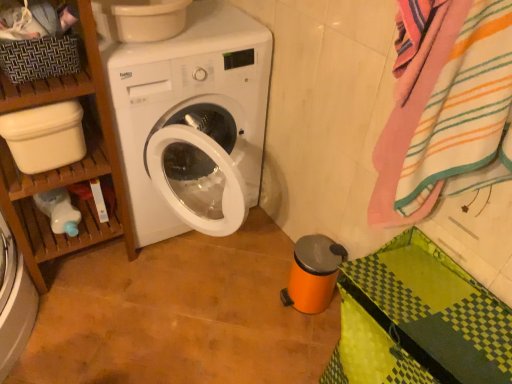
This screenshot has width=512, height=384. Describe the element at coordinates (66, 166) in the screenshot. I see `wooden shelf at left` at that location.

Where is `wooden shelf at left`? The width and height of the screenshot is (512, 384). wooden shelf at left is located at coordinates (66, 166).

Between wooden shelf at left and striped cotton bath towel at right, which one appears on the right side from the viewer's perspective?

striped cotton bath towel at right.

Based on the photo, is wooden shelf at left wider or thinner than striped cotton bath towel at right?

Clearly, wooden shelf at left has more width compared to striped cotton bath towel at right.

Does point (92, 30) come closer to viewer compared to point (509, 86)?

No, it is not.

I want to click on shelf located underneath the striped cotton bath towel at right (from a real-world perspective), so (x=66, y=166).

In terms of height, does striped cotton bath towel at right look taller or shorter compared to woven brown basket at upper left?

Clearly, striped cotton bath towel at right is taller compared to woven brown basket at upper left.

From the image's perspective, is striped cotton bath towel at right under woven brown basket at upper left?

Yes.

Which is correct: striped cotton bath towel at right is inside woven brown basket at upper left, or outside of it?

striped cotton bath towel at right is not inside woven brown basket at upper left, it's outside.

From the picture: From a real-world perspective, relative to woven brown basket at upper left, is striped cotton bath towel at right vertically above or below?

In terms of real-world spatial position, striped cotton bath towel at right is above woven brown basket at upper left.

Is wooden shelf at left bigger or smaller than woven brown basket at upper left?

Considering their sizes, wooden shelf at left takes up more space than woven brown basket at upper left.

How much distance is there between wooden shelf at left and woven brown basket at upper left?

wooden shelf at left is 28.94 centimeters from woven brown basket at upper left.

Considering the relative sizes of wooden shelf at left and woven brown basket at upper left in the image provided, is wooden shelf at left shorter than woven brown basket at upper left?

No, wooden shelf at left is not shorter than woven brown basket at upper left.

From the picture: From the image's perspective, is wooden shelf at left below woven brown basket at upper left?

Yes, from the image's perspective, wooden shelf at left is below woven brown basket at upper left.

Which object is positioned more to the left, striped cotton bath towel at right or wooden shelf at left?

From the viewer's perspective, wooden shelf at left appears more on the left side.

Which of these two, striped cotton bath towel at right or wooden shelf at left, is thinner?

striped cotton bath towel at right is thinner.

Where is `bath towel lying above the wooden shelf at left (from the image's perspective)`? This screenshot has height=384, width=512. bath towel lying above the wooden shelf at left (from the image's perspective) is located at coordinates (447, 112).

From a real-world perspective, is woven brown basket at upper left above or below wooden shelf at left?

woven brown basket at upper left is situated higher than wooden shelf at left in the real world.

Who is smaller, woven brown basket at upper left or wooden shelf at left?

woven brown basket at upper left is smaller.

From the image's perspective, is woven brown basket at upper left under wooden shelf at left?

Actually, woven brown basket at upper left appears above wooden shelf at left in the image.

Choose the correct answer: Is woven brown basket at upper left inside wooden shelf at left or outside it?

The correct answer is: inside.

How distant is woven brown basket at upper left from striped cotton bath towel at right?

The distance of woven brown basket at upper left from striped cotton bath towel at right is 97.92 centimeters.

Based on the photo, does woven brown basket at upper left turn towards striped cotton bath towel at right?

No, woven brown basket at upper left does not turn towards striped cotton bath towel at right.

Between woven brown basket at upper left and striped cotton bath towel at right, which one has larger width?

With larger width is woven brown basket at upper left.

The image size is (512, 384). I want to click on bath towel lying on the right of wooden shelf at left, so click(447, 112).

Locate an element on the screen. The height and width of the screenshot is (384, 512). basket to the left of striped cotton bath towel at right is located at coordinates (40, 58).

Considering their positions, is striped cotton bath towel at right positioned further to wooden shelf at left than woven brown basket at upper left?

Among the two, striped cotton bath towel at right is located further to wooden shelf at left.

Considering their positions, is striped cotton bath towel at right positioned further to woven brown basket at upper left than wooden shelf at left?

Among the two, striped cotton bath towel at right is located further to woven brown basket at upper left.

Looking at the image, which one is located closer to wooden shelf at left, woven brown basket at upper left or striped cotton bath towel at right?

woven brown basket at upper left.

Which object lies nearer to the anchor point striped cotton bath towel at right, woven brown basket at upper left or wooden shelf at left?

Among the two, wooden shelf at left is located nearer to striped cotton bath towel at right.

When comparing their distances from woven brown basket at upper left, does wooden shelf at left or striped cotton bath towel at right seem closer?

Among the two, wooden shelf at left is located nearer to woven brown basket at upper left.

From the image, which object appears to be farther from striped cotton bath towel at right, wooden shelf at left or woven brown basket at upper left?

woven brown basket at upper left is further to striped cotton bath towel at right.

Where is `basket situated between wooden shelf at left and striped cotton bath towel at right from left to right`? The width and height of the screenshot is (512, 384). basket situated between wooden shelf at left and striped cotton bath towel at right from left to right is located at coordinates (40, 58).